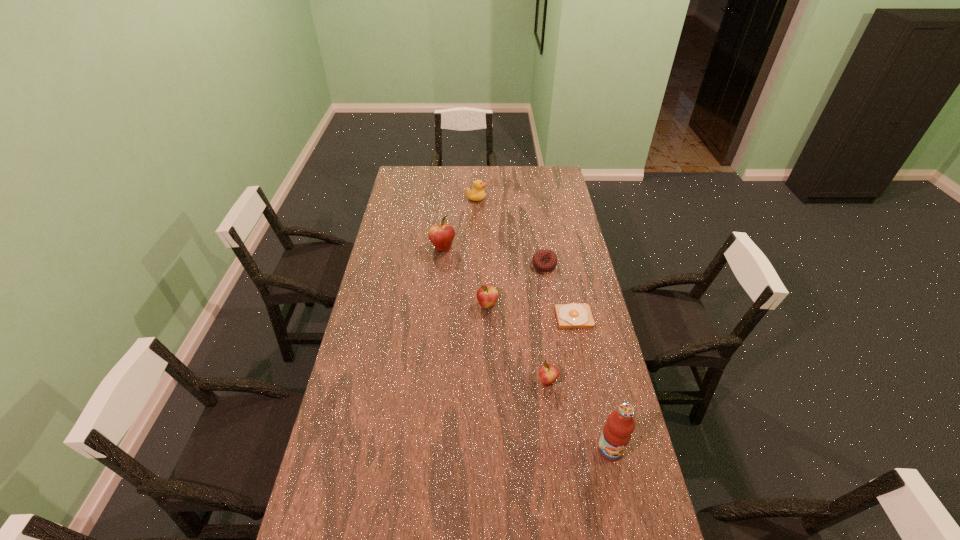
Find the location of a particular element. The width and height of the screenshot is (960, 540). vacant point located between the second nearest apple and the farthest object is located at coordinates (482, 252).

The image size is (960, 540). Identify the location of free spot between the leftmost object and the farthest object. (459, 224).

Find the location of a particular element. free space between the second tallest apple and the leftmost object is located at coordinates (465, 277).

Where is `free spot between the second apple from right to left and the rightmost apple`? This screenshot has height=540, width=960. free spot between the second apple from right to left and the rightmost apple is located at coordinates (517, 343).

This screenshot has width=960, height=540. What are the coordinates of `vacant space in between the farthest object and the beanbag` in the screenshot? It's located at (510, 232).

What are the coordinates of `vacant area between the tallest apple and the second shortest object` in the screenshot? It's located at (493, 257).

Image resolution: width=960 pixels, height=540 pixels. I want to click on free space between the farthest apple and the toast, so 509,283.

Where is `blank region between the second tallest apple and the second shortest object`? The image size is (960, 540). blank region between the second tallest apple and the second shortest object is located at coordinates (516, 285).

Image resolution: width=960 pixels, height=540 pixels. In order to click on object that is the fourth closest one to the second apple from right to left in this screenshot , I will do `click(548, 374)`.

The height and width of the screenshot is (540, 960). In order to click on object that is the second closest to the tallest object in this screenshot , I will do `click(573, 315)`.